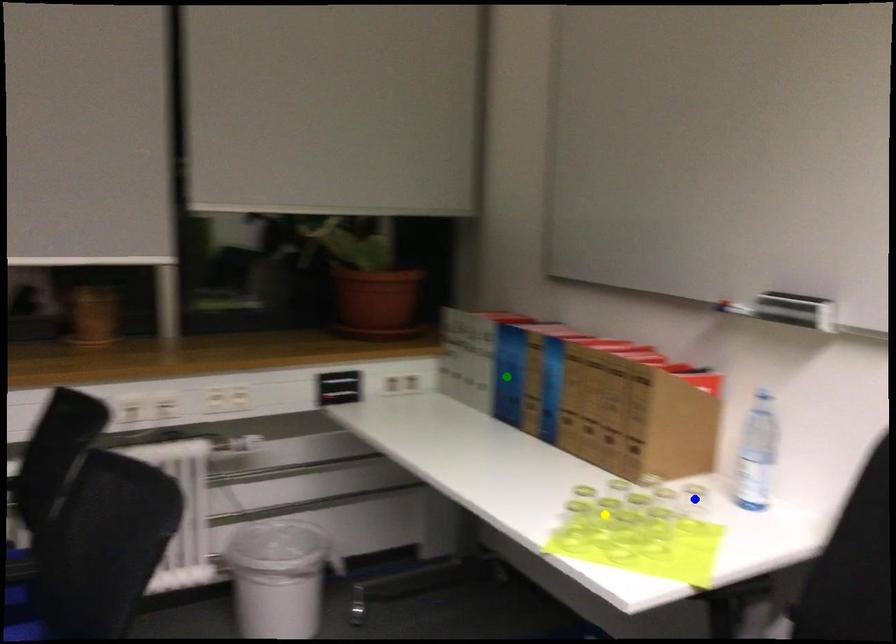
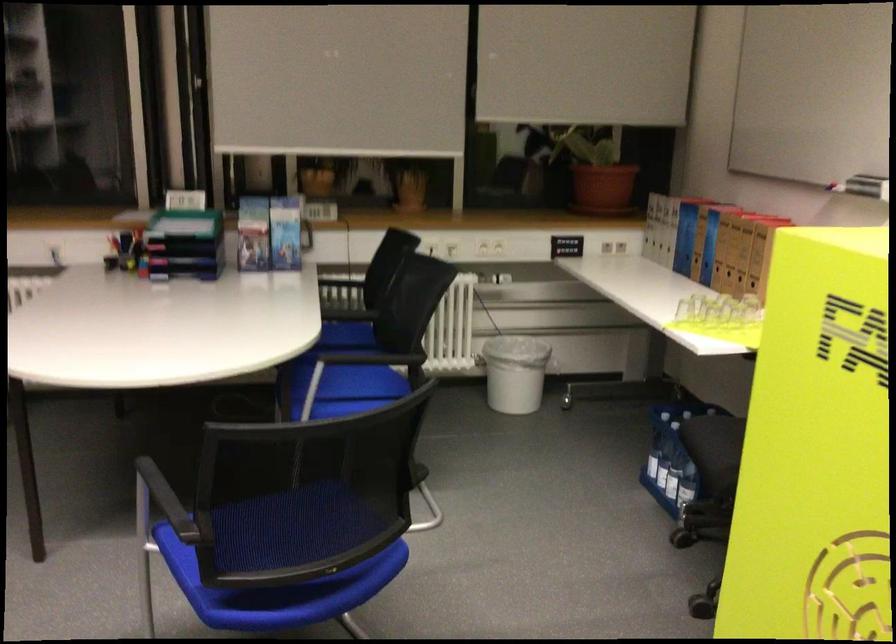
I am providing you with two images of the same scene from different viewpoints. Three points are marked in image1. Which point corresponds to a part or object that is occluded in image2?In image1, three points are marked. Which of them correspond to a part or object that is occluded in image2?Among the three points shown in image1, which one corresponds to a part or object that is no longer visible due to occlusion in image2?

blue point